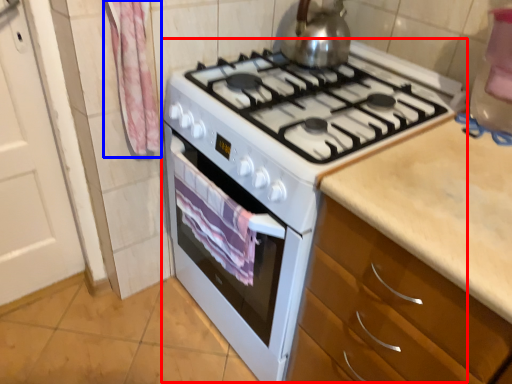
Question: Which point is further to the camera, appliance (highlighted by a red box) or curtain (highlighted by a blue box)?

Choices:
 (A) appliance
 (B) curtain

Answer: (B)